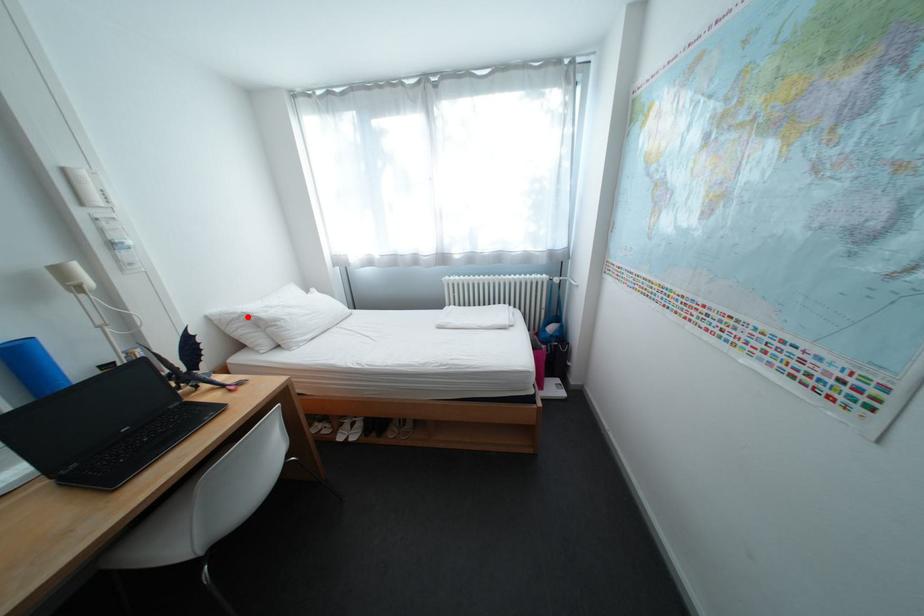
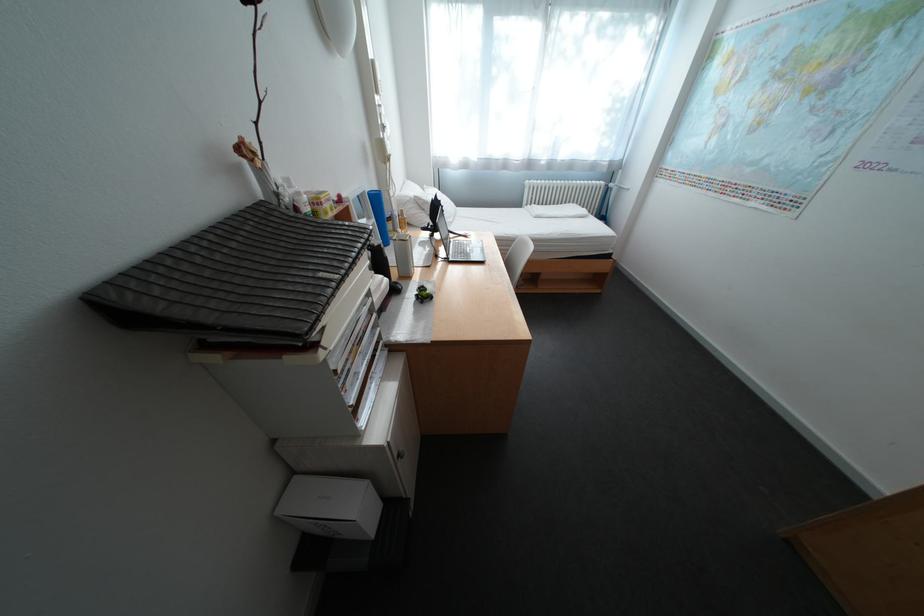
Locate, in the second image, the point that corresponds to the highlighted location in the first image.

(420, 200)